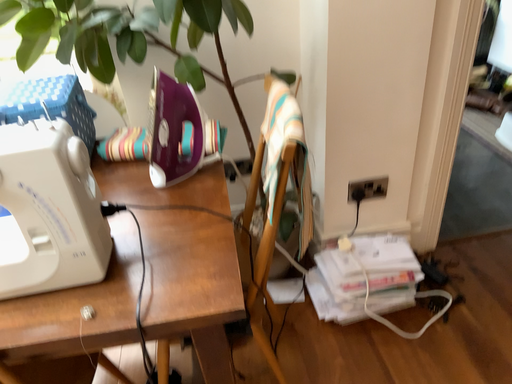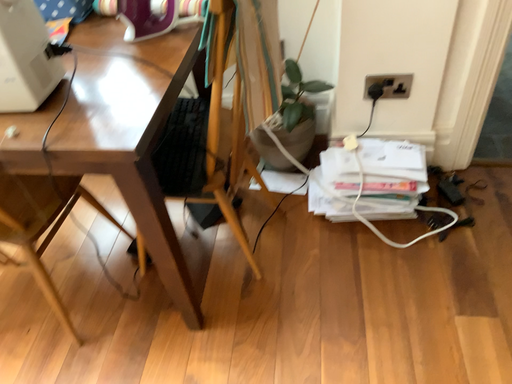
Question: How did the camera likely rotate when shooting the video?

Choices:
 (A) rotated right
 (B) rotated left

Answer: (B)